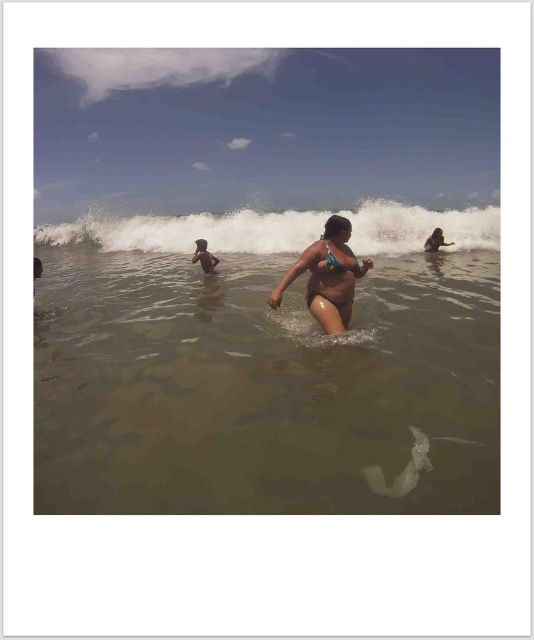
Is smooth skin surfer at center to the right of smooth skin girl at upper right from the viewer's perspective?

Incorrect, smooth skin surfer at center is not on the right side of smooth skin girl at upper right.

Which is more to the right, smooth skin surfer at center or smooth skin girl at upper right?

smooth skin girl at upper right is more to the right.

Locate an element on the screen. The height and width of the screenshot is (640, 534). smooth skin surfer at center is located at coordinates (205, 257).

Identify the location of smooth skin surfer at center. The width and height of the screenshot is (534, 640). (205, 257).

Does brown matte water at center appear under matte yellow bikini at center?

Yes, brown matte water at center is below matte yellow bikini at center.

Does point (497, 342) come closer to viewer compared to point (318, 284)?

No, (497, 342) is behind (318, 284).

At what (x,y) coordinates should I click in order to perform the action: click on brown matte water at center. Please return your answer as a coordinate pair (x, y). Looking at the image, I should click on (263, 388).

Identify the location of brown matte water at center. (263, 388).

Can you confirm if brown matte water at center is wider than smooth skin surfer at center?

Yes.

Measure the distance between point [343,509] and camera.

Point [343,509] is 3.08 meters away from camera.

This screenshot has height=640, width=534. I want to click on brown matte water at center, so click(x=263, y=388).